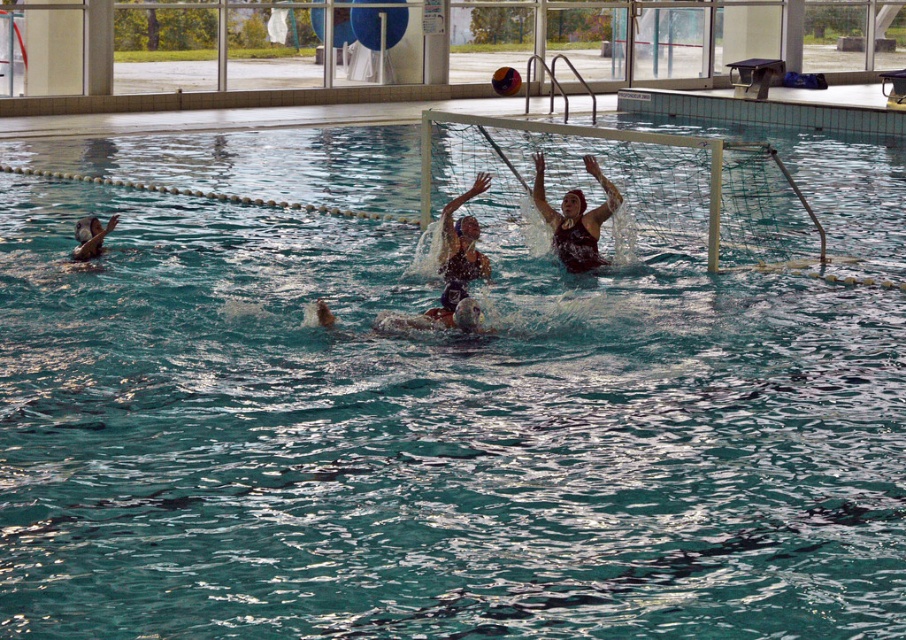
From the picture: Can you confirm if dark brown swimsuit at upper center is smaller than smooth skin face at lower left?

Actually, dark brown swimsuit at upper center might be larger than smooth skin face at lower left.

Based on the photo, is the position of dark brown swimsuit at upper center less distant than that of smooth skin face at lower left?

No, it is behind smooth skin face at lower left.

The height and width of the screenshot is (640, 906). Identify the location of dark brown swimsuit at upper center. (576, 218).

The height and width of the screenshot is (640, 906). I want to click on dark brown swimsuit at upper center, so click(x=576, y=218).